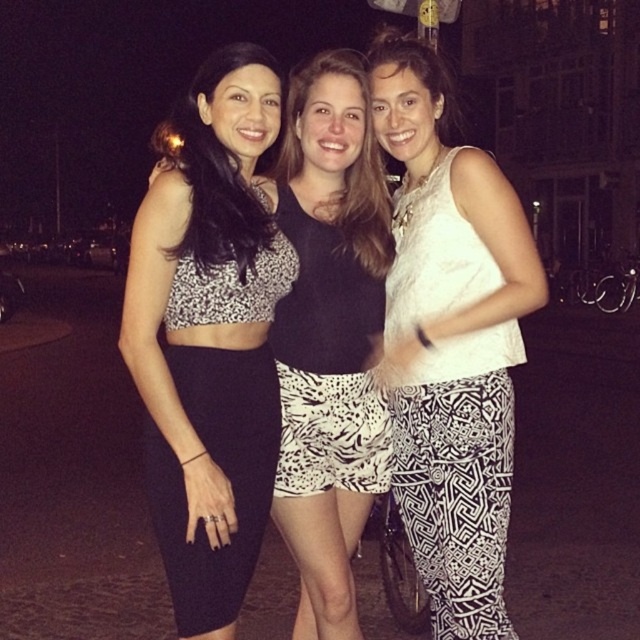
Question: Does white lace top at center appear on the right side of printed fabric crop top at center?

Choices:
 (A) yes
 (B) no

Answer: (A)

Question: Which point is farther to the camera?

Choices:
 (A) printed fabric crop top at center
 (B) black printed fabric dress at left
 (C) white lace top at center

Answer: (A)

Question: Is printed fabric crop top at center above black printed fabric dress at left?

Choices:
 (A) yes
 (B) no

Answer: (A)

Question: Considering the relative positions of white lace top at center and printed fabric crop top at center in the image provided, where is white lace top at center located with respect to printed fabric crop top at center?

Choices:
 (A) right
 (B) left

Answer: (A)

Question: Which object appears farthest from the camera in this image?

Choices:
 (A) white lace top at center
 (B) printed fabric crop top at center

Answer: (B)

Question: Among these objects, which one is farthest from the camera?

Choices:
 (A) white lace top at center
 (B) white zebra-patterned shorts at center
 (C) black printed fabric dress at left

Answer: (B)